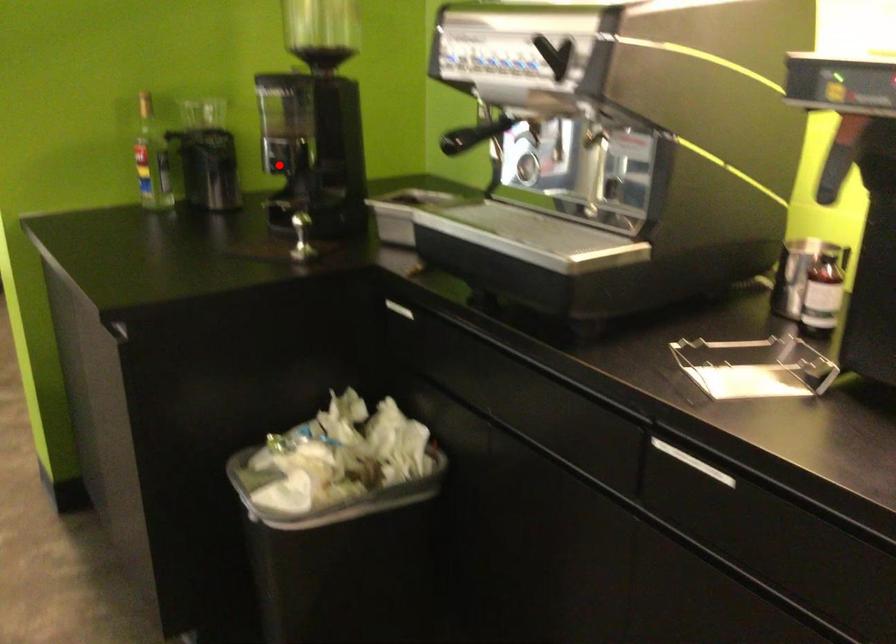
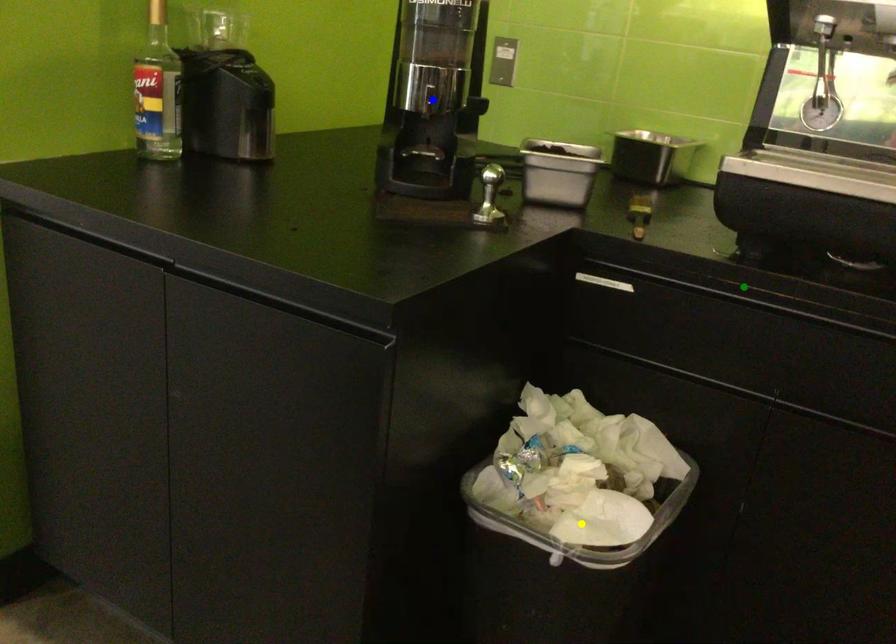
Question: I am providing you with two images of the same scene from different viewpoints. A red point is marked on the first image. You are given multiple points on the second image. Can you choose the point in image 2 that corresponds to the point in image 1?

Choices:
 (A) green point
 (B) blue point
 (C) yellow point

Answer: (B)